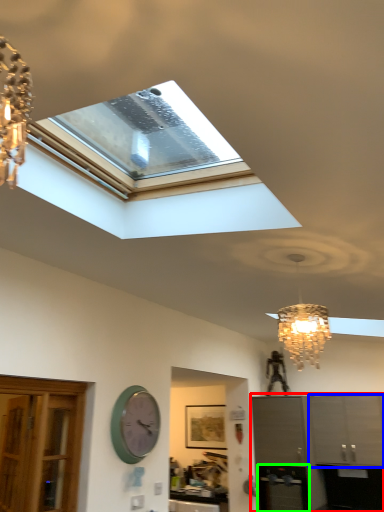
Question: Based on their relative distances, which object is nearer to cabinetry (highlighted by a red box)? Choose from cabinetry (highlighted by a blue box) and appliance (highlighted by a green box).

Choices:
 (A) cabinetry
 (B) appliance

Answer: (A)